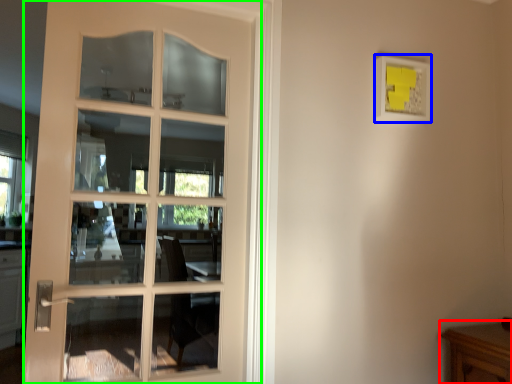
Question: Based on their relative distances, which object is farther from table (highlighted by a red box)? Choose from picture frame (highlighted by a blue box) and door (highlighted by a green box).

Choices:
 (A) picture frame
 (B) door

Answer: (B)